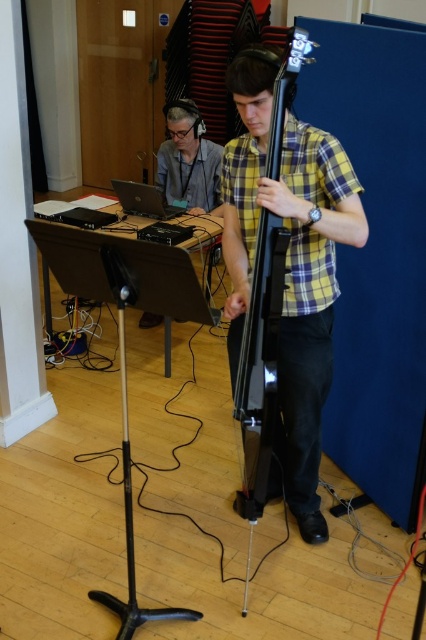
Does matte gray headphones at upper left appear on the right side of silver metallic laptop at center?

Correct, you'll find matte gray headphones at upper left to the right of silver metallic laptop at center.

Does matte gray headphones at upper left come behind silver metallic laptop at center?

Yes, matte gray headphones at upper left is behind silver metallic laptop at center.

Is point (212, 179) closer to viewer compared to point (150, 211)?

No, it is behind (150, 211).

The image size is (426, 640). What are the coordinates of `matte gray headphones at upper left` in the screenshot? It's located at (189, 163).

Which is more to the left, matte gray headphones at upper left or black matte tripod at lower left?

Positioned to the left is black matte tripod at lower left.

This screenshot has height=640, width=426. What do you see at coordinates (189, 163) in the screenshot?
I see `matte gray headphones at upper left` at bounding box center [189, 163].

Where is `matte gray headphones at upper left`? matte gray headphones at upper left is located at coordinates (189, 163).

Does glossy black bass guitar at center come in front of black matte tripod at lower left?

Yes, glossy black bass guitar at center is in front of black matte tripod at lower left.

Between glossy black bass guitar at center and black matte tripod at lower left, which one is positioned lower?

Positioned lower is black matte tripod at lower left.

Does point (255, 371) come closer to viewer compared to point (146, 616)?

Yes, point (255, 371) is closer to viewer.

You are a GUI agent. You are given a task and a screenshot of the screen. Output one action in this format:
    pyautogui.click(x=<x>, y=<y>)
    Task: Click on the glossy black bass guitar at center
    The image size is (426, 640).
    Given the screenshot: What is the action you would take?
    pyautogui.click(x=259, y=355)